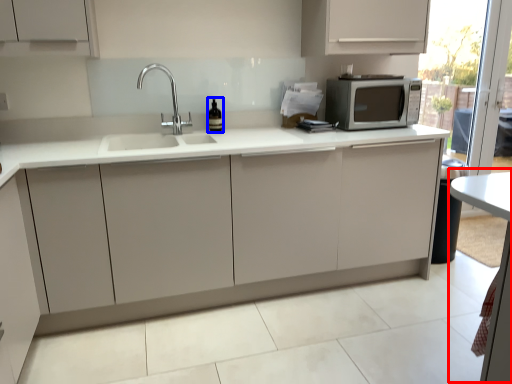
Question: Which object appears closest to the camera in this image, table (highlighted by a red box) or wine bottle (highlighted by a blue box)?

Choices:
 (A) table
 (B) wine bottle

Answer: (A)